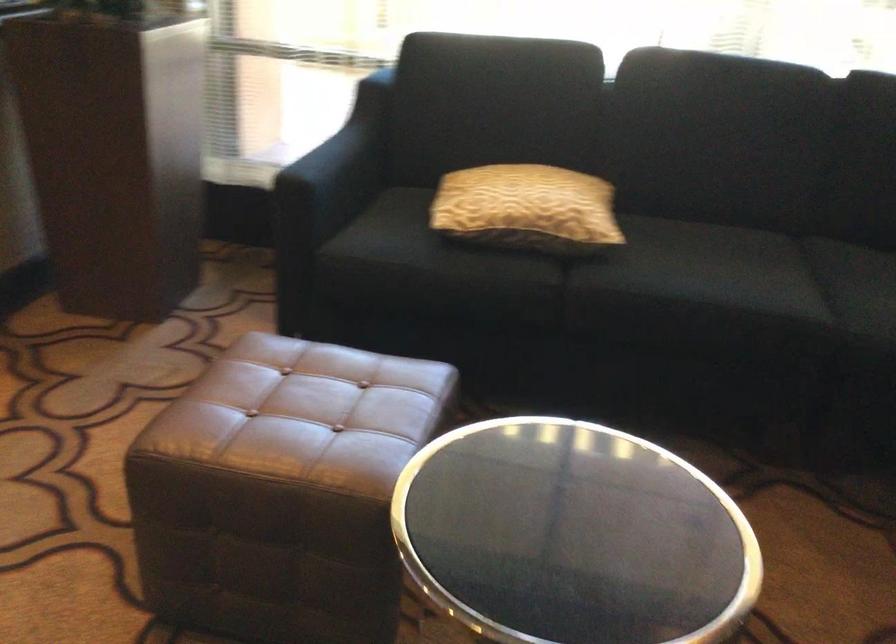
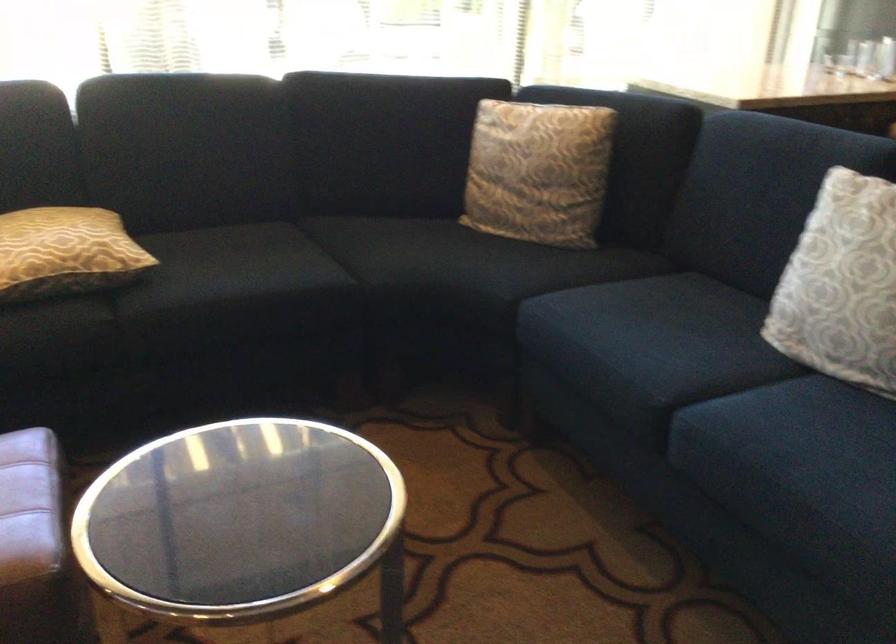
Question: The camera is either moving clockwise (left) or counter-clockwise (right) around the object. The first image is from the beginning of the video and the second image is from the end. Is the camera moving left or right when shooting the video?

Choices:
 (A) Left
 (B) Right

Answer: (A)